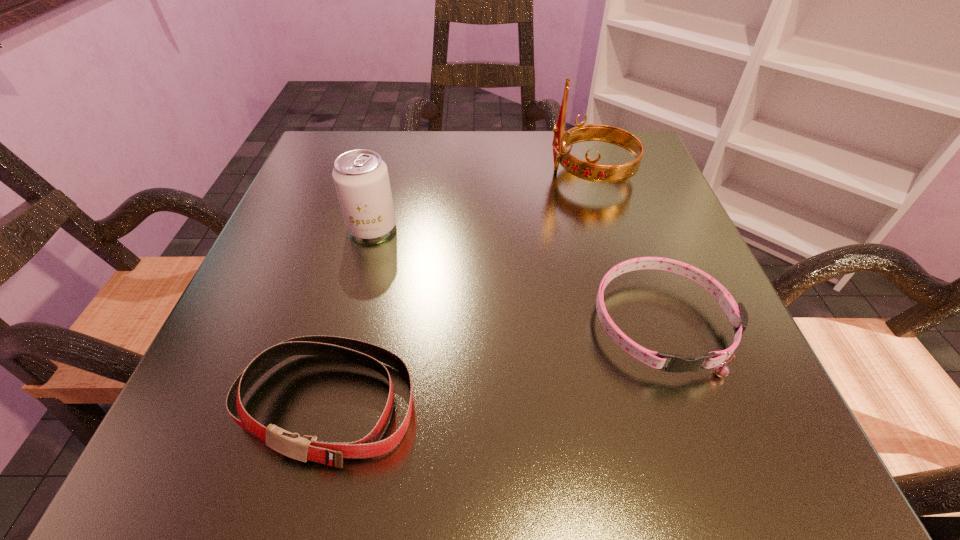
This screenshot has height=540, width=960. Identify the location of free space between the taller dog collar and the third shortest object. (350, 316).

Where is `free space that is in between the third nearest object and the shortest object`? The width and height of the screenshot is (960, 540). free space that is in between the third nearest object and the shortest object is located at coordinates (516, 275).

This screenshot has height=540, width=960. I want to click on vacant space in between the third shortest object and the tiara, so 482,200.

Where is `free space between the shorter dog collar and the second farthest object`? The width and height of the screenshot is (960, 540). free space between the shorter dog collar and the second farthest object is located at coordinates (516, 275).

Identify the location of vacant area between the tiara and the shorter dog collar. (626, 248).

Find the location of a particular element. The image size is (960, 540). free space between the third tallest object and the farthest object is located at coordinates (460, 289).

What are the coordinates of `free space between the tiara and the shorter dog collar` in the screenshot? It's located at (626, 248).

Where is `empty location between the shortest object and the tallest object`? The image size is (960, 540). empty location between the shortest object and the tallest object is located at coordinates pyautogui.click(x=626, y=248).

You are a GUI agent. You are given a task and a screenshot of the screen. Output one action in this format:
    pyautogui.click(x=<x>, y=<y>)
    Task: Click on the free space that is in between the tiara and the third shortest object
    
    Given the screenshot: What is the action you would take?
    pyautogui.click(x=482, y=200)

Choose which object is the nearest neighbor to the taller dog collar. Please provide its 2D coordinates. Your answer should be formatted as a tuple, i.e. [(x, y)], where the tuple contains the x and y coordinates of a point satisfying the conditions above.

[(361, 179)]